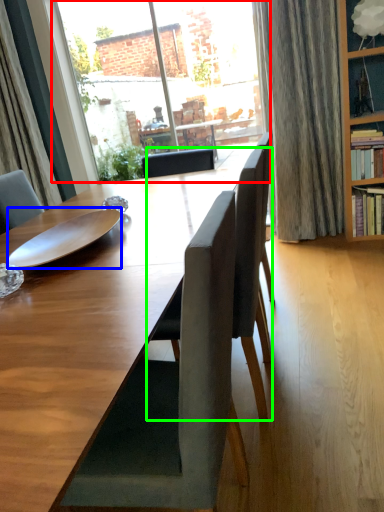
Question: Based on their relative distances, which object is farther from window (highlighted by a red box)? Choose from plate (highlighted by a blue box) and chair (highlighted by a green box).

Choices:
 (A) plate
 (B) chair

Answer: (B)